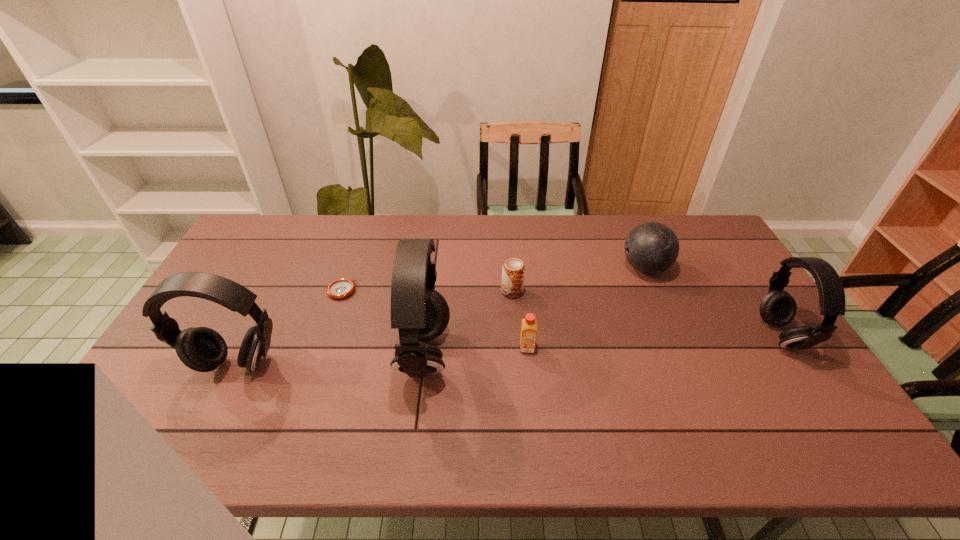
Find the location of a particular element. This screenshot has width=960, height=540. orange juice is located at coordinates pos(529,325).

This screenshot has height=540, width=960. In order to click on vacant region located 0.090m on the ear cups of the second tallest earphone in this screenshot , I will do `click(210, 414)`.

I want to click on free spot located on the ear cups of the second earphone from right to left, so click(275, 354).

Where is `vacant position located on the ear cups of the second earphone from right to left`? The height and width of the screenshot is (540, 960). vacant position located on the ear cups of the second earphone from right to left is located at coordinates tap(271, 354).

What are the coordinates of `blank area located on the ear cups of the second earphone from right to left` in the screenshot? It's located at (363, 354).

Image resolution: width=960 pixels, height=540 pixels. In order to click on free space located on the ear cups of the shortest earphone in this screenshot , I will do `click(682, 335)`.

Locate an element on the screen. free space located on the ear cups of the shortest earphone is located at coordinates (692, 335).

You are a GUI agent. You are given a task and a screenshot of the screen. Output one action in this format:
    pyautogui.click(x=<x>, y=<y>)
    Task: Click on the free region located 0.260m on the ear cups of the shortest earphone
    
    Given the screenshot: What is the action you would take?
    pyautogui.click(x=671, y=335)

At what (x,y) coordinates should I click in order to perform the action: click on free space located 0.400m on the grip area of the bowling ball. Please return your answer as a coordinate pair (x, y). Looking at the image, I should click on (500, 268).

The width and height of the screenshot is (960, 540). What are the coordinates of `vacant space located on the grip area of the bowling ball` in the screenshot? It's located at (593, 268).